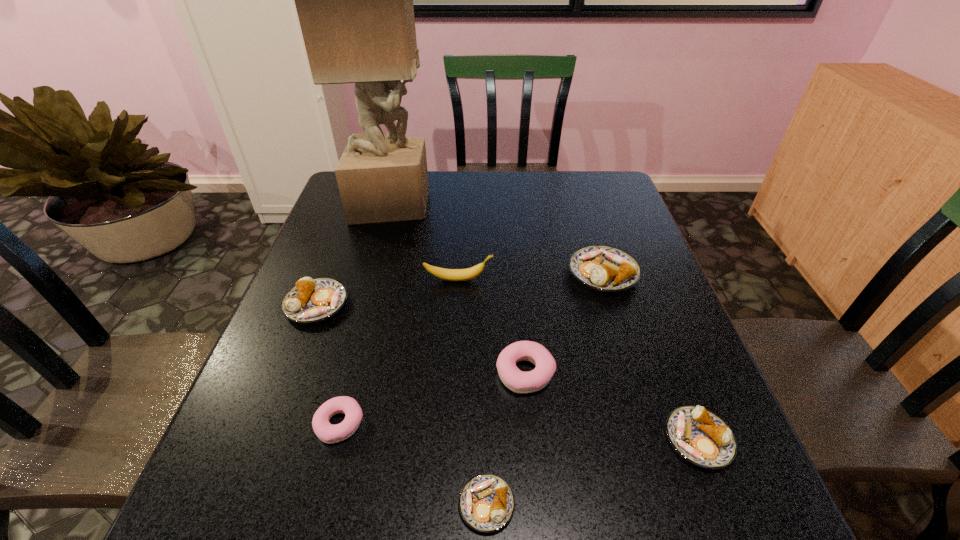
Where is `free spot that satisfies the following two spatial constraints: 1. at the stem of the yellow banana; 2. on the back side of the bigger pink pastry`? free spot that satisfies the following two spatial constraints: 1. at the stem of the yellow banana; 2. on the back side of the bigger pink pastry is located at coordinates (454, 373).

Where is `vacant region that satisfies the following two spatial constraints: 1. on the front side of the leftmost brown pastry; 2. on the left side of the second nearest brown pastry`? vacant region that satisfies the following two spatial constraints: 1. on the front side of the leftmost brown pastry; 2. on the left side of the second nearest brown pastry is located at coordinates (264, 440).

The image size is (960, 540). I want to click on vacant space that satisfies the following two spatial constraints: 1. at the stem of the yellow banana; 2. on the left side of the second nearest brown pastry, so click(x=450, y=440).

At what (x,y) coordinates should I click in order to perform the action: click on free space that satisfies the following two spatial constraints: 1. on the back side of the farther pink pastry; 2. on the left side of the nearer pink pastry. Please return your answer as a coordinate pair (x, y). Looking at the image, I should click on (353, 373).